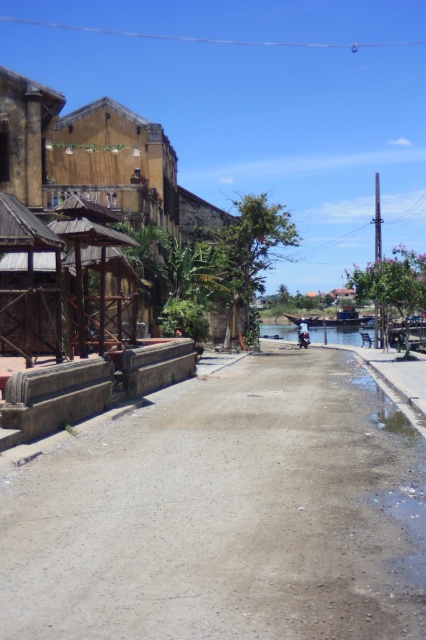
You are a delivery person with a cart that is 10 feet wide. You need to navigate between the wooden hut at upper left and the wooden hut at center. Can your cart fit through the space between them?

The wooden hut at upper left and wooden hut at center are 29.74 feet apart from each other. Since your cart is 10 feet wide, there is enough space for it to pass through the 29.74 feet gap between the two huts.

You are standing at the entrance of the street scene and want to find the dull concrete alley at center. Based on the coordinates provided, in which direction should you walk to locate it?

The dull concrete alley at center is located at coordinates point (224, 512). Since the coordinate system typically places the origin at the bottom left corner, moving towards higher x values means moving to the right and higher y values mean moving upwards. Therefore, to reach the dull concrete alley at center, you should walk diagonally to the right and upwards from the entrance.